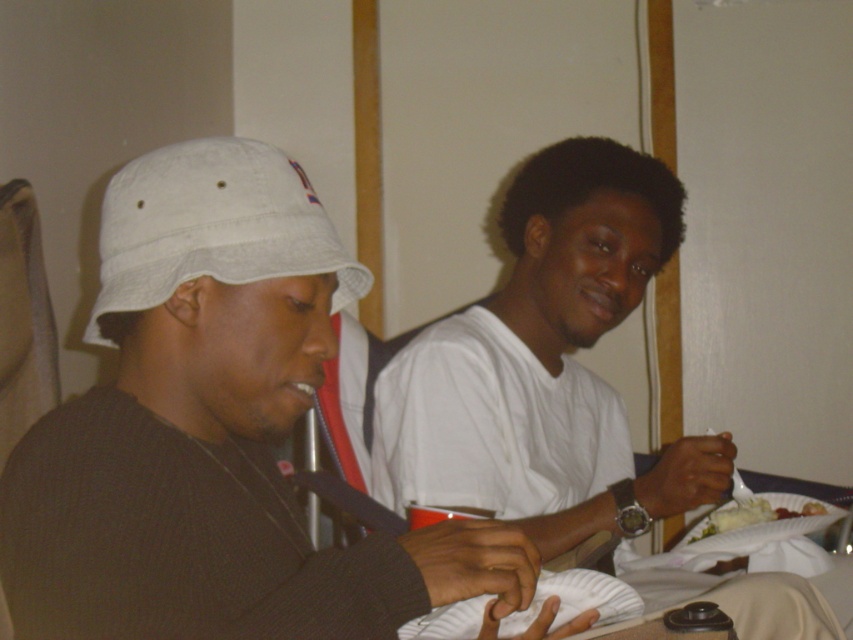
Question: From the image, what is the correct spatial relationship of white matte bucket hat at left in relation to white creamy mashed potatoes at lower right?

Choices:
 (A) right
 (B) left

Answer: (B)

Question: Which of the following is the closest to the observer?

Choices:
 (A) (782, 516)
 (B) (218, 212)
 (C) (380, 445)
 (D) (39, 595)

Answer: (D)

Question: Which object appears closest to the camera in this image?

Choices:
 (A) white fabric baseball hat at left
 (B) white matte shirt at center

Answer: (A)

Question: Can you confirm if white matte bucket hat at left is bigger than white creamy mashed potatoes at lower right?

Choices:
 (A) yes
 (B) no

Answer: (A)

Question: Which point is closer to the camera?

Choices:
 (A) white matte bucket hat at left
 (B) white fabric baseball hat at left
 (C) white creamy mashed potatoes at lower right

Answer: (A)

Question: Does white matte bucket hat at left come behind white matte shirt at center?

Choices:
 (A) yes
 (B) no

Answer: (B)